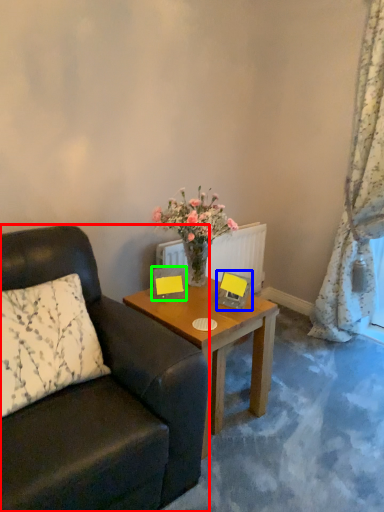
Question: Which is farther away from chair (highlighted by a red box)? picture frame (highlighted by a blue box) or picture frame (highlighted by a green box)?

Choices:
 (A) picture frame
 (B) picture frame

Answer: (A)